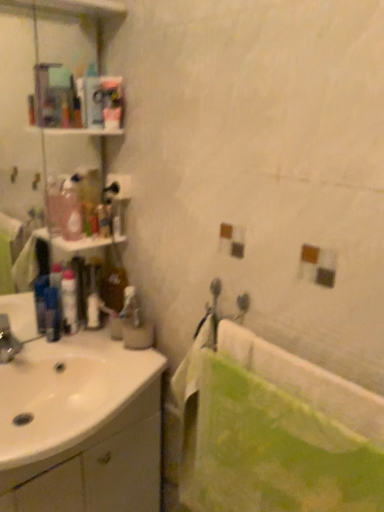
Question: From the image's perspective, is blue plastic mouthwash at left located above or below translucent plastic bottle at left?

Choices:
 (A) above
 (B) below

Answer: (B)

Question: Is blue plastic mouthwash at left to the left or to the right of translucent plastic bottle at left in the image?

Choices:
 (A) left
 (B) right

Answer: (A)

Question: Estimate the real-world distances between objects in this image. Which object is closer to the translucent plastic bottle at left?

Choices:
 (A) translucent plastic bottles at left
 (B) white glossy sink at left
 (C) blue plastic mouthwash at left
 (D) metallic silver faucet at left
 (E) white glossy lotion at left, acting as the 2th toiletry starting from the right

Answer: (A)

Question: Based on their relative distances, which object is nearer to the green fabric towel at lower right?

Choices:
 (A) green fabric bath at right
 (B) translucent plastic bottles at left
 (C) metallic silver faucet at left
 (D) translucent plastic bottle at left
 (E) white glossy sink at left

Answer: (A)